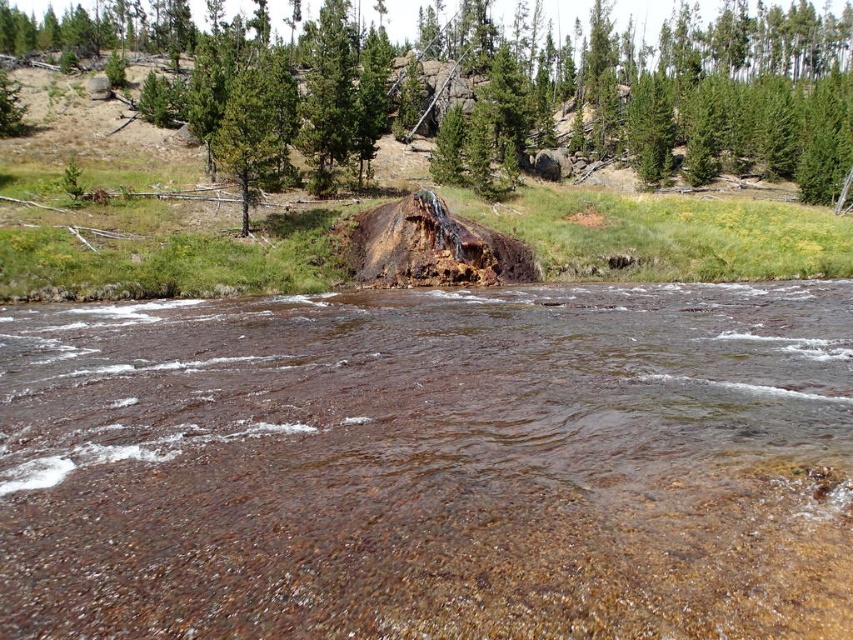
Is green rough bark tree at upper center further to the viewer compared to green rough bark tree trunk at center?

No, green rough bark tree at upper center is in front of green rough bark tree trunk at center.

Who is more forward, (265, 161) or (245, 198)?

Point (245, 198) is more forward.

Which is in front, point (260, 122) or point (239, 184)?

Positioned in front is point (260, 122).

The height and width of the screenshot is (640, 853). Find the location of `green rough bark tree at upper center`. green rough bark tree at upper center is located at coordinates (253, 129).

Which is in front, point (698, 396) or point (283, 138)?

Point (698, 396)

Locate an element on the screen. The width and height of the screenshot is (853, 640). clear water at center is located at coordinates 431,465.

This screenshot has width=853, height=640. Find the location of `clear water at center`. clear water at center is located at coordinates (431, 465).

Find the location of `clear water at center`. clear water at center is located at coordinates (431, 465).

Between green matte tree at center and green rough bark tree trunk at center, which one appears on the right side from the viewer's perspective?

Positioned to the right is green rough bark tree trunk at center.

Can you confirm if green matte tree at center is thinner than green rough bark tree trunk at center?

In fact, green matte tree at center might be wider than green rough bark tree trunk at center.

Find the location of a particular element. green matte tree at center is located at coordinates (540, 84).